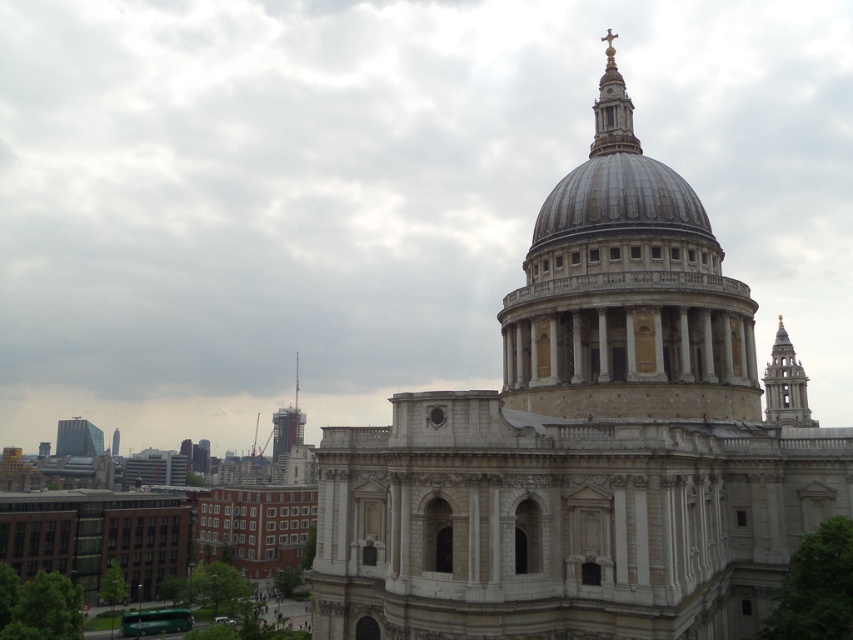
Question: Can you confirm if beige stone dome at center is positioned to the right of dark gray concrete tower at center?

Choices:
 (A) yes
 (B) no

Answer: (A)

Question: Which point is closer to the camera taking this photo?

Choices:
 (A) (817, 422)
 (B) (717, 412)
 (C) (300, 429)
 (D) (648, 468)

Answer: (D)

Question: Considering the real-world distances, which object is farthest from the gold polished metal cross at upper center?

Choices:
 (A) beige stone dome at center
 (B) glass reflective skyscraper at left

Answer: (B)

Question: Does beige stone dome at center have a larger size compared to dark gray concrete tower at center?

Choices:
 (A) yes
 (B) no

Answer: (A)

Question: Which point is closer to the camera?

Choices:
 (A) gold textured spire at upper right
 (B) white stone cathedral at center
 (C) glass reflective skyscraper at left

Answer: (B)

Question: Is gold textured spire at upper right closer to the viewer compared to dark gray concrete tower at center?

Choices:
 (A) no
 (B) yes

Answer: (B)